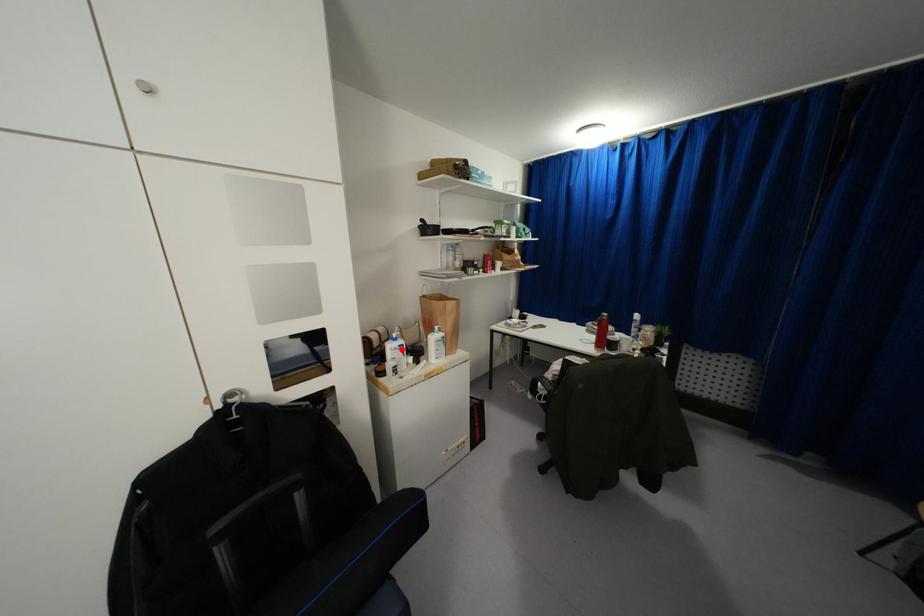
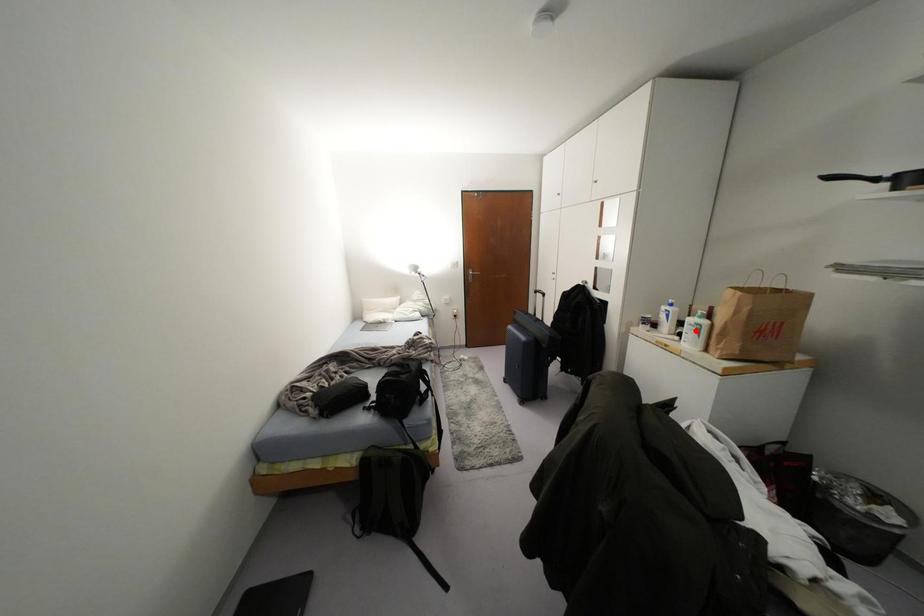
I am providing you with two images of the same scene from different viewpoints. A red point is marked on the first image and another point is marked on the second image. Is the marked point in image1 the same physical position as the marked point in image2?

No